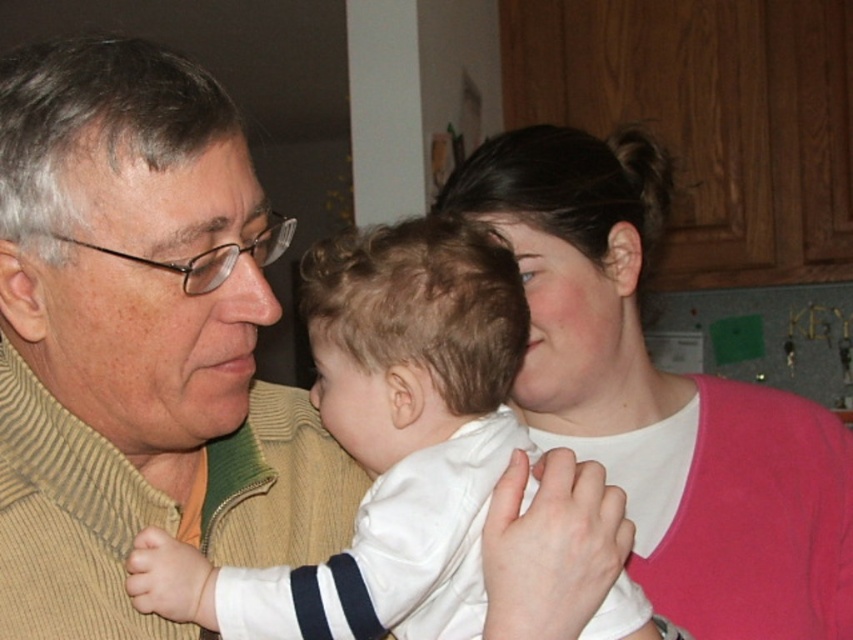
Can you confirm if pink matte sweater at upper right is positioned below white satin baby at center?

No, pink matte sweater at upper right is not below white satin baby at center.

Does pink matte sweater at upper right appear on the right side of white satin baby at center?

Correct, you'll find pink matte sweater at upper right to the right of white satin baby at center.

Where is `pink matte sweater at upper right`? pink matte sweater at upper right is located at coordinates (662, 400).